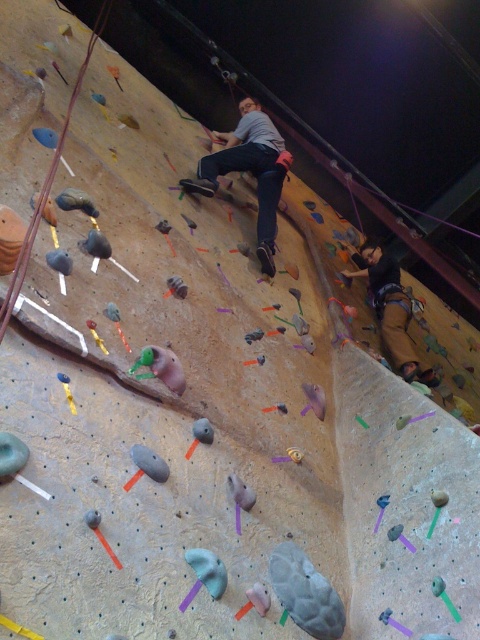
Question: Does gray matte shirt at center come in front of brown leather pants at lower right?

Choices:
 (A) yes
 (B) no

Answer: (A)

Question: Is gray matte shirt at center bigger than brown leather pants at lower right?

Choices:
 (A) yes
 (B) no

Answer: (A)

Question: Which point appears farthest from the camera in this image?

Choices:
 (A) (260, 195)
 (B) (403, 298)

Answer: (B)

Question: Is the position of gray matte shirt at center less distant than that of brown leather pants at lower right?

Choices:
 (A) yes
 (B) no

Answer: (A)

Question: Which point is closer to the camera taking this photo?

Choices:
 (A) pos(288,152)
 (B) pos(380,298)

Answer: (A)